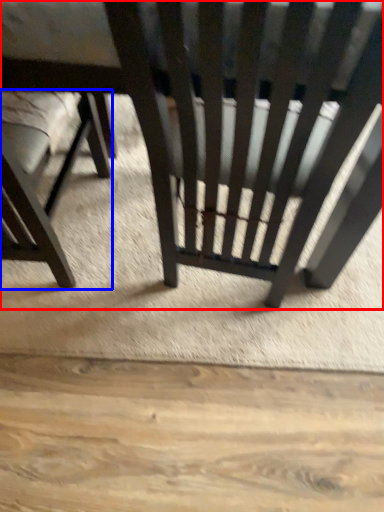
Question: Which point is further to the camera, chair (highlighted by a red box) or chair (highlighted by a blue box)?

Choices:
 (A) chair
 (B) chair

Answer: (B)